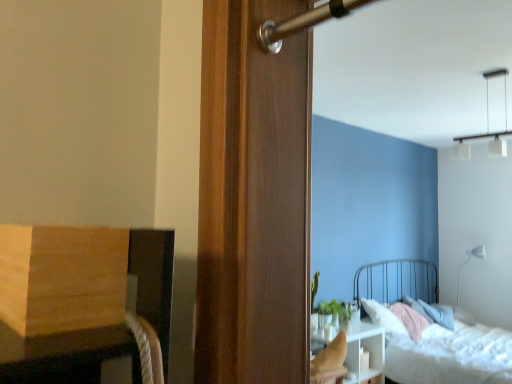
Question: Can you confirm if white glossy nightstand at lower right is taller than white textured bed at lower right?

Choices:
 (A) no
 (B) yes

Answer: (A)

Question: Can you confirm if white glossy nightstand at lower right is smaller than white textured bed at lower right?

Choices:
 (A) no
 (B) yes

Answer: (B)

Question: Is white glossy nightstand at lower right thinner than white textured bed at lower right?

Choices:
 (A) yes
 (B) no

Answer: (A)

Question: Would you say white glossy nightstand at lower right is a long distance from white textured bed at lower right?

Choices:
 (A) no
 (B) yes

Answer: (A)

Question: From a real-world perspective, is white glossy nightstand at lower right located beneath white textured bed at lower right?

Choices:
 (A) yes
 (B) no

Answer: (A)

Question: From the image's perspective, does white glossy nightstand at lower right appear lower than white textured bed at lower right?

Choices:
 (A) yes
 (B) no

Answer: (A)

Question: Does white glass pendant lights at upper right, which is the first light fixture in top-to-bottom order, have a lesser width compared to white matte floor lamp at upper right, the 2th light fixture positioned from the front?

Choices:
 (A) yes
 (B) no

Answer: (B)

Question: Is white glass pendant lights at upper right, which appears as the second light fixture when viewed from the back, further to camera compared to white matte floor lamp at upper right, the 1th light fixture when ordered from right to left?

Choices:
 (A) yes
 (B) no

Answer: (B)

Question: Does white glass pendant lights at upper right, placed as the first light fixture when sorted from left to right, have a greater width compared to white matte floor lamp at upper right, the first light fixture when ordered from back to front?

Choices:
 (A) yes
 (B) no

Answer: (A)

Question: Is white glass pendant lights at upper right, the first light fixture from the front, placed right next to white matte floor lamp at upper right, the first light fixture when ordered from back to front?

Choices:
 (A) yes
 (B) no

Answer: (B)

Question: Is white glass pendant lights at upper right, which is the first light fixture in top-to-bottom order, far away from white matte floor lamp at upper right, the 2th light fixture positioned from the front?

Choices:
 (A) no
 (B) yes

Answer: (B)

Question: Does white glass pendant lights at upper right, placed as the first light fixture when sorted from left to right, appear on the right side of white matte floor lamp at upper right, arranged as the 2th light fixture when viewed from the top?

Choices:
 (A) no
 (B) yes

Answer: (A)

Question: Is white matte floor lamp at upper right, which is counted as the 2th light fixture, starting from the left, aimed at green matte plant at center?

Choices:
 (A) no
 (B) yes

Answer: (B)